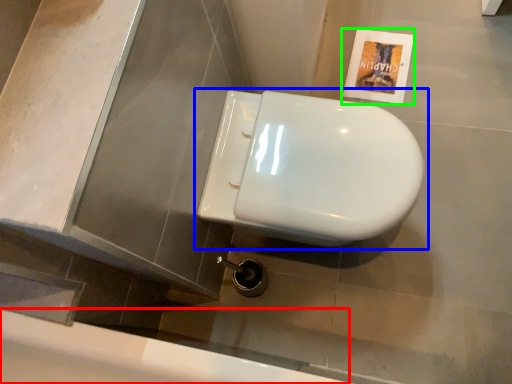
Question: Considering the real-world distances, which object is farthest from bath (highlighted by a red box)? toilet (highlighted by a blue box) or flyer (highlighted by a green box)?

Choices:
 (A) toilet
 (B) flyer

Answer: (B)